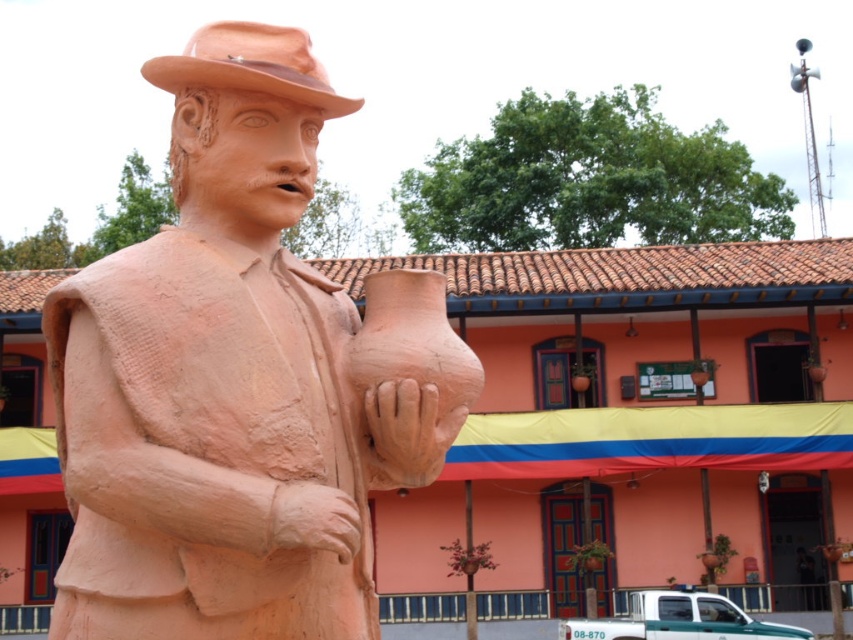
Question: Which point appears closest to the camera in this image?

Choices:
 (A) (149, 566)
 (B) (305, 97)

Answer: (A)

Question: Can you confirm if matte clay statue at center is thinner than matte clay fedora at upper center?

Choices:
 (A) yes
 (B) no

Answer: (B)

Question: Which point is closer to the camera?

Choices:
 (A) (210, 84)
 (B) (267, 177)

Answer: (B)

Question: Can you confirm if matte clay statue at center is positioned above matte clay fedora at upper center?

Choices:
 (A) yes
 (B) no

Answer: (B)

Question: Can you confirm if matte clay statue at center is positioned below matte clay fedora at upper center?

Choices:
 (A) no
 (B) yes

Answer: (B)

Question: Which point is closer to the camera?

Choices:
 (A) matte clay statue at center
 (B) matte clay fedora at upper center

Answer: (A)